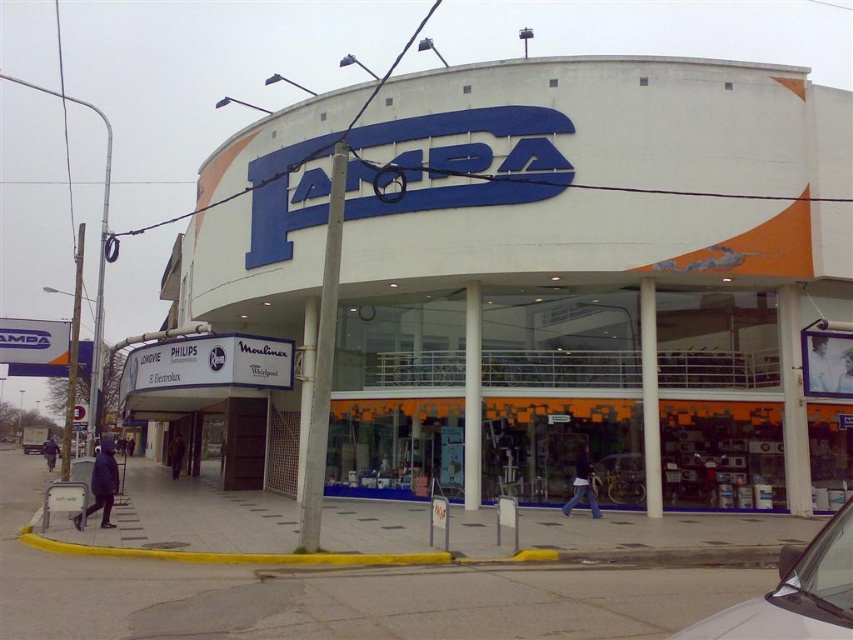
Question: Does white glossy building at center appear under white glossy car at lower right?

Choices:
 (A) yes
 (B) no

Answer: (B)

Question: Which of the following is the closest to the observer?

Choices:
 (A) white glossy car at lower right
 (B) white glossy building at center

Answer: (A)

Question: Which point appears closest to the camera in this image?

Choices:
 (A) (804, 627)
 (B) (312, 138)

Answer: (A)

Question: Does white glossy building at center appear on the right side of white glossy car at lower right?

Choices:
 (A) no
 (B) yes

Answer: (A)

Question: Is white glossy building at center bigger than white glossy car at lower right?

Choices:
 (A) no
 (B) yes

Answer: (B)

Question: Which object appears closest to the camera in this image?

Choices:
 (A) white glossy car at lower right
 (B) white glossy building at center

Answer: (A)